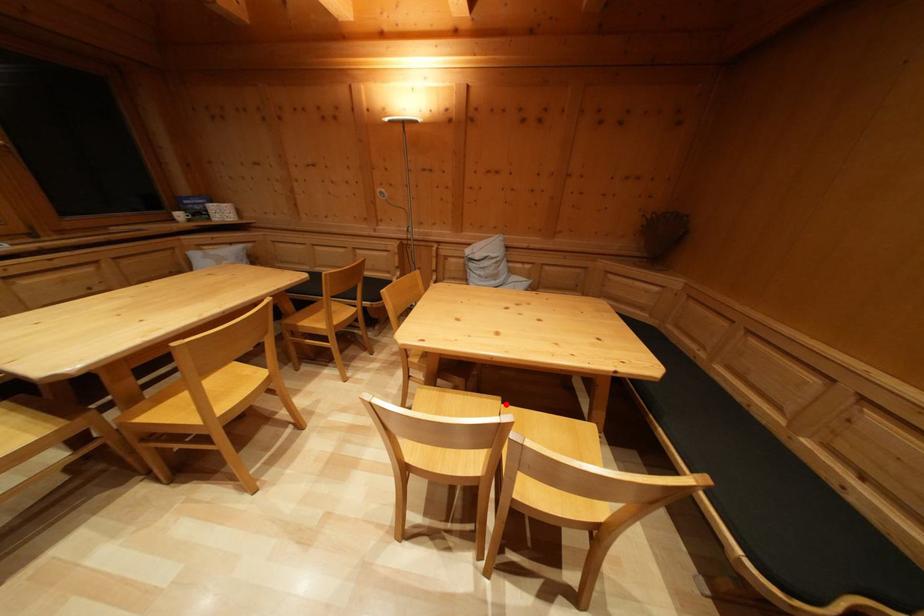
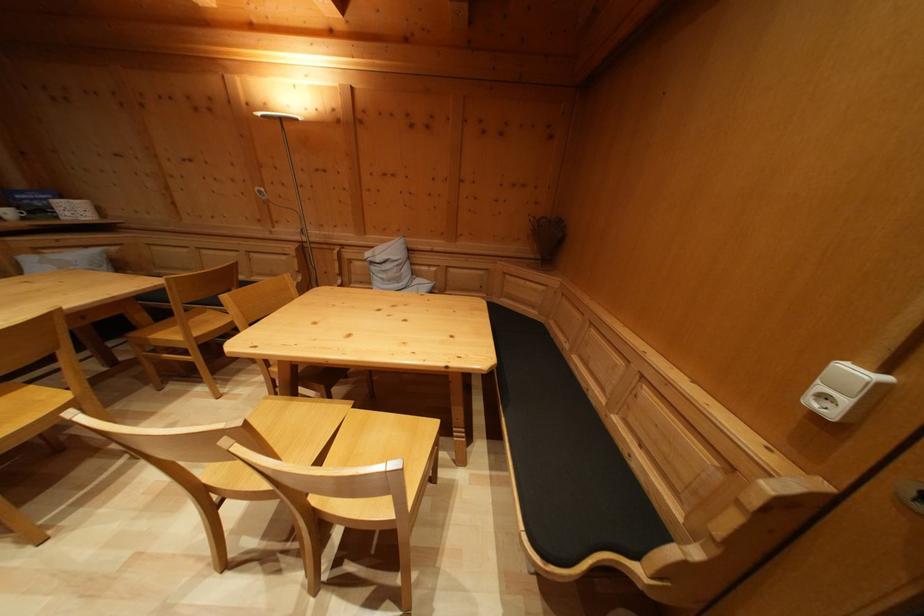
Question: I am providing you with two images of the same scene from different viewpoints. Given a red point in image1, look at the same physical point in image2. Is it:

Choices:
 (A) Closer to the viewpoint
 (B) Farther from the viewpoint

Answer: (B)